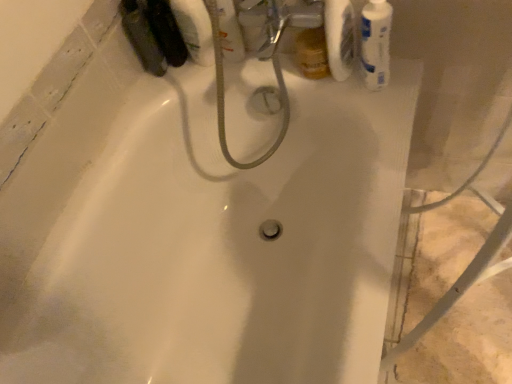
Question: In the image, is white glossy mouthwash at upper right, the 3th mouthwash from the left, on the left side or the right side of clear plastic bottle at upper center, marked as the 2th mouthwash in a left-to-right arrangement?

Choices:
 (A) right
 (B) left

Answer: (A)

Question: Is white glossy mouthwash at upper right, arranged as the first mouthwash when viewed from the right, spatially inside clear plastic bottle at upper center, which is the 2th mouthwash from right to left, or outside of it?

Choices:
 (A) inside
 (B) outside

Answer: (B)

Question: Based on their relative distances, which object is nearer to the clear plastic bottle at upper center, marked as the 2th mouthwash in a left-to-right arrangement?

Choices:
 (A) white matte toilet paper at upper right
 (B) white glossy mouthwash at upper right, arranged as the first mouthwash when viewed from the right
 (C) matte black bottle at upper left, the third mouthwash in the right-to-left sequence

Answer: (C)

Question: Estimate the real-world distances between objects in this image. Which object is farther from the white glossy mouthwash at upper right, arranged as the first mouthwash when viewed from the right?

Choices:
 (A) white matte toilet paper at upper right
 (B) clear plastic bottle at upper center, marked as the 2th mouthwash in a left-to-right arrangement
 (C) matte black bottle at upper left, the third mouthwash in the right-to-left sequence

Answer: (C)